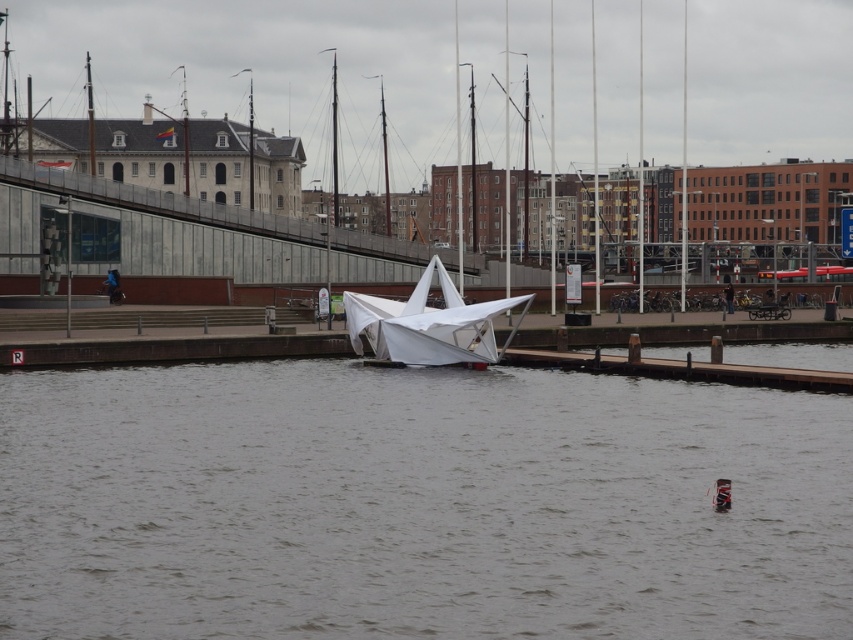
You are standing on the dock and see the gray matte water at center and the white matte sailboat at center. Which object is closer to you?

The gray matte water at center is closer to you because it is in front of the white matte sailboat at center.

You are standing at the dock and want to know which point is nearer to you. The points are point (434, 548) and point (381, 353). Which one is closer?

Point (434, 548) is closer to the viewer than point (381, 353).

You are a boat operator trying to navigate a vessel through the waterfront scene. The vessel requires a minimum of 20 meters of clearance between the gray matte water at center and the white matte sailboat at center to safely pass. Based on the scene provided, can your vessel safely navigate through this area?

The distance between the gray matte water at center and the white matte sailboat at center is 18.52 meters, which is less than the required 20 meters clearance. Therefore, the vessel cannot safely navigate through this area.